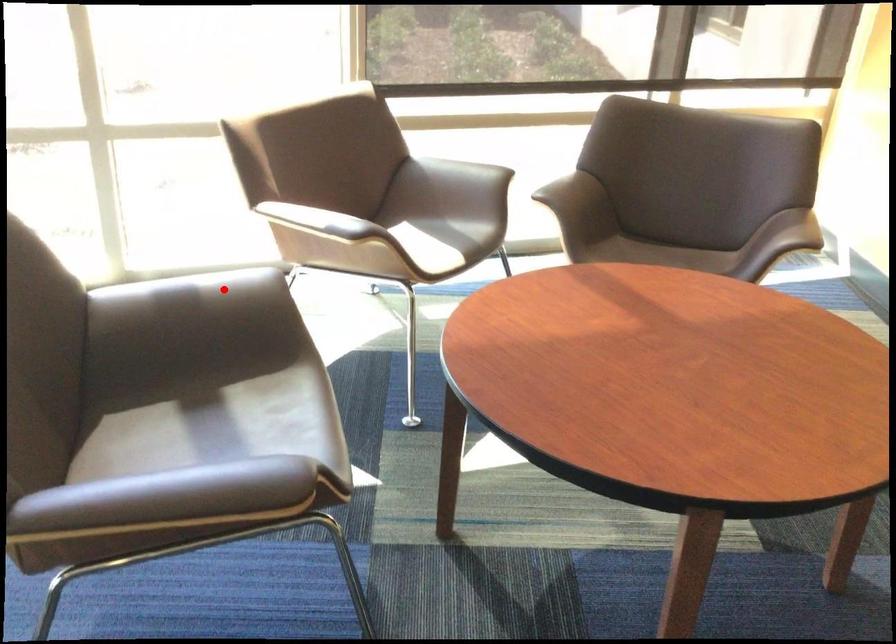
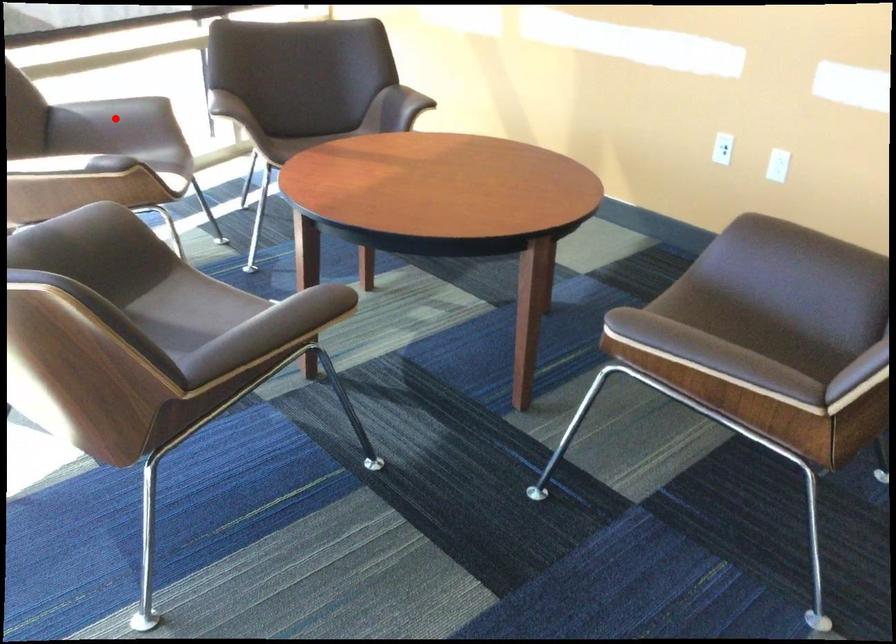
I am providing you with two images of the same scene from different viewpoints. A red point is marked on the first image and another point is marked on the second image. Does the point marked in image1 correspond to the same location as the one in image2?

No